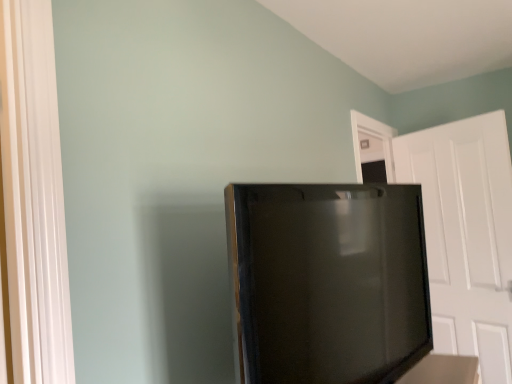
Question: Does white matte door at right turn towards black glossy refrigerator at center?

Choices:
 (A) yes
 (B) no

Answer: (A)

Question: Considering the relative positions of white matte door at right and black glossy refrigerator at center in the image provided, is white matte door at right in front of black glossy refrigerator at center?

Choices:
 (A) yes
 (B) no

Answer: (B)

Question: Can you confirm if white matte door at right is taller than black glossy refrigerator at center?

Choices:
 (A) no
 (B) yes

Answer: (B)

Question: Does white matte door at right come behind black glossy refrigerator at center?

Choices:
 (A) no
 (B) yes

Answer: (B)

Question: From a real-world perspective, is white matte door at right on top of black glossy refrigerator at center?

Choices:
 (A) yes
 (B) no

Answer: (B)

Question: Would you say black glossy refrigerator at center is part of white matte door at right's contents?

Choices:
 (A) yes
 (B) no

Answer: (B)

Question: Does black glossy refrigerator at center have a lesser width compared to white matte door at right?

Choices:
 (A) no
 (B) yes

Answer: (A)

Question: From a real-world perspective, is black glossy refrigerator at center positioned under white matte door at right based on gravity?

Choices:
 (A) yes
 (B) no

Answer: (B)

Question: Can you confirm if black glossy refrigerator at center is shorter than white matte door at right?

Choices:
 (A) no
 (B) yes

Answer: (B)

Question: Is black glossy refrigerator at center behind white matte door at right?

Choices:
 (A) yes
 (B) no

Answer: (B)

Question: From the image's perspective, is black glossy refrigerator at center located beneath white matte door at right?

Choices:
 (A) no
 (B) yes

Answer: (A)

Question: Is black glossy refrigerator at center not inside white matte door at right?

Choices:
 (A) no
 (B) yes

Answer: (B)

Question: Is white matte door at right taller or shorter than black glossy refrigerator at center?

Choices:
 (A) tall
 (B) short

Answer: (A)